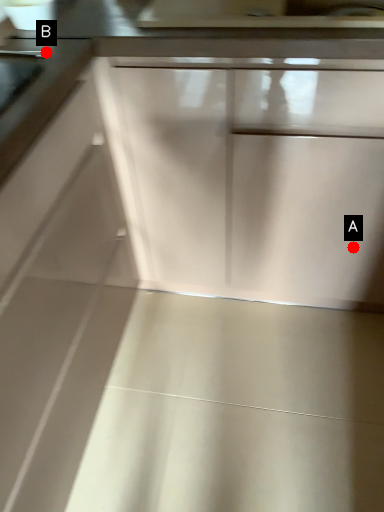
Question: Two points are circled on the image, labeled by A and B beside each circle. Which point appears closest to the camera in this image?

Choices:
 (A) A is closer
 (B) B is closer

Answer: (B)